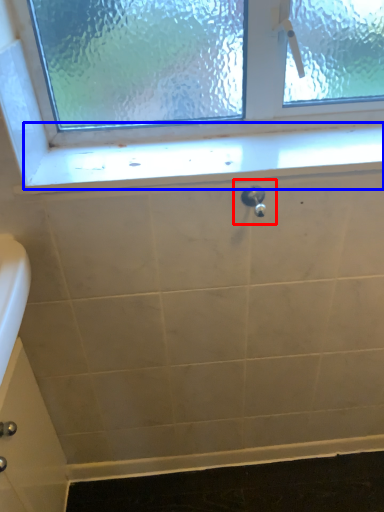
Question: Which of the following is the farthest to the observer, plumbing fixture (highlighted by a red box) or window sill (highlighted by a blue box)?

Choices:
 (A) plumbing fixture
 (B) window sill

Answer: (B)